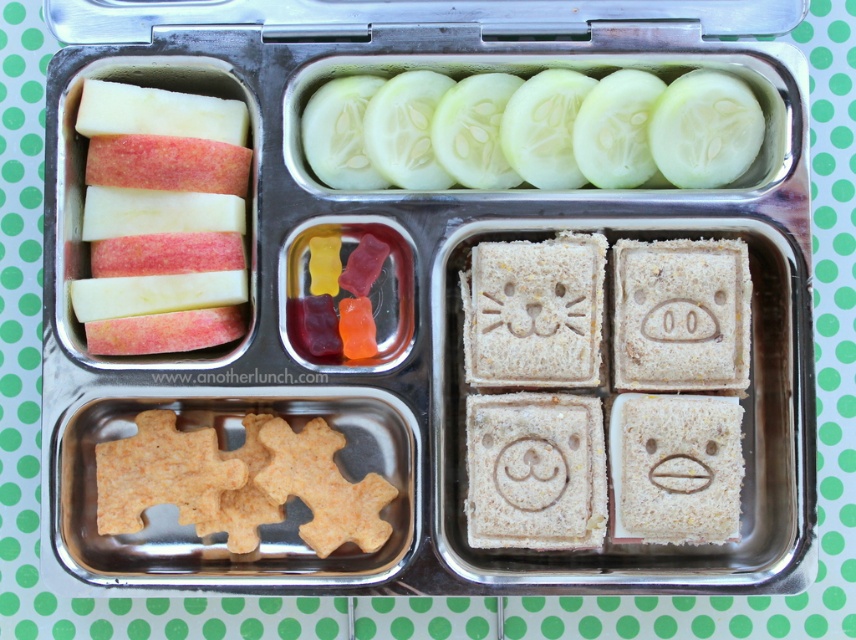
Question: Among these points, which one is farthest from the camera?

Choices:
 (A) (473, 122)
 (B) (137, 189)

Answer: (A)

Question: Is green cucumber slices at upper center bigger than red matte apple at left?

Choices:
 (A) no
 (B) yes

Answer: (B)

Question: Does green cucumber slices at upper center come in front of red matte apple at left?

Choices:
 (A) yes
 (B) no

Answer: (B)

Question: Among these objects, which one is nearest to the camera?

Choices:
 (A) green cucumber slices at upper center
 (B) red matte apple at left

Answer: (B)

Question: Is green cucumber slices at upper center further to camera compared to red matte apple at left?

Choices:
 (A) yes
 (B) no

Answer: (A)